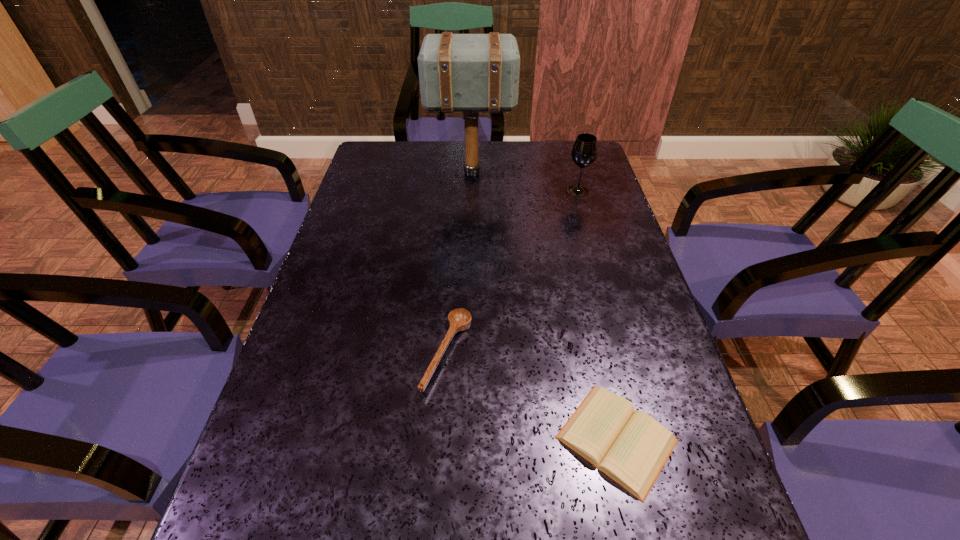
Image resolution: width=960 pixels, height=540 pixels. In order to click on vacant region between the third tallest object and the second tallest object in this screenshot , I will do [513, 272].

Locate an element on the screen. Image resolution: width=960 pixels, height=540 pixels. empty location between the shortest object and the third tallest object is located at coordinates (532, 396).

Where is `free space between the second shortest object and the diary`? free space between the second shortest object and the diary is located at coordinates (532, 396).

Locate an element on the screen. The width and height of the screenshot is (960, 540). free spot between the second shortest object and the shortest object is located at coordinates (532, 396).

Identify the location of empty space that is in between the diary and the mallet. The height and width of the screenshot is (540, 960). (543, 306).

Where is `the closest object to the third tallest object`? The height and width of the screenshot is (540, 960). the closest object to the third tallest object is located at coordinates (631, 448).

Point out which object is positioned as the nearest to the wooden spoon. Please provide its 2D coordinates. Your answer should be formatted as a tuple, i.e. [(x, y)], where the tuple contains the x and y coordinates of a point satisfying the conditions above.

[(631, 448)]

In order to click on vacant space that satisfies the following two spatial constraints: 1. on the striking surface of the mallet; 2. on the left side of the third shortest object in this screenshot , I will do `click(470, 191)`.

At what (x,y) coordinates should I click in order to perform the action: click on free spot that satisfies the following two spatial constraints: 1. on the striking surface of the mallet; 2. on the front side of the second shortest object. Please return your answer as a coordinate pair (x, y). Looking at the image, I should click on (467, 353).

The image size is (960, 540). Find the location of `vacant region that satisfies the following two spatial constraints: 1. on the striking surface of the wineglass; 2. on the left side of the mallet`. vacant region that satisfies the following two spatial constraints: 1. on the striking surface of the wineglass; 2. on the left side of the mallet is located at coordinates (470, 191).